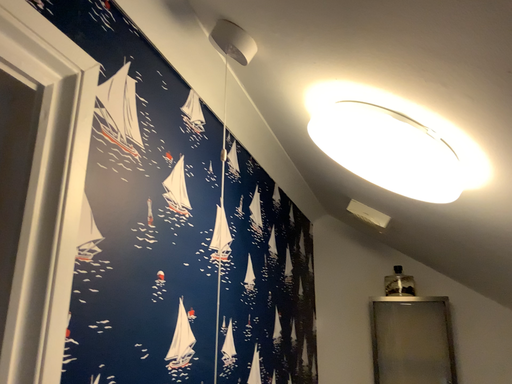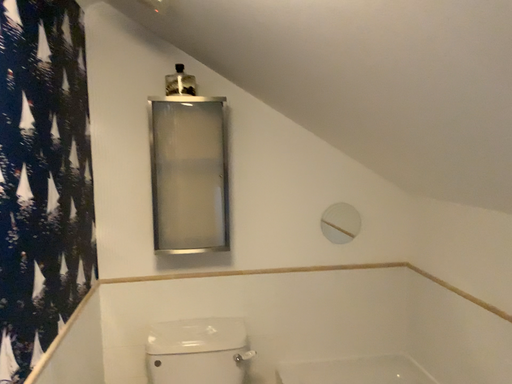
Question: Which way did the camera rotate in the video?

Choices:
 (A) rotated downward
 (B) rotated upward

Answer: (A)